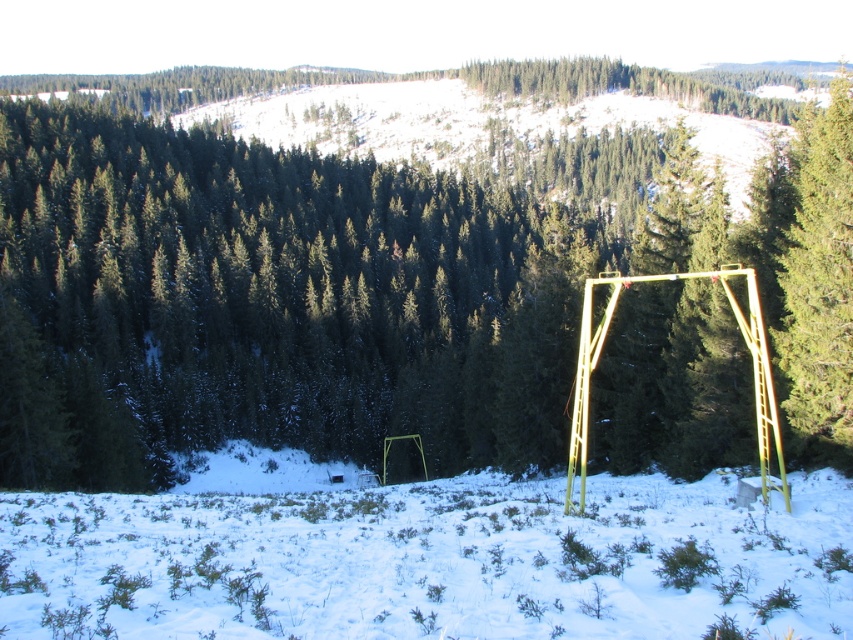
Question: From the image, what is the correct spatial relationship of green matte swing at center in relation to green matte tree at center-right?

Choices:
 (A) below
 (B) above

Answer: (B)

Question: Among these objects, which one is nearest to the camera?

Choices:
 (A) green matte swing at center
 (B) green matte tree at center-right
 (C) white powdery snow at lower center

Answer: (C)

Question: Considering the relative positions of green matte swing at center and white powdery snow at lower center in the image provided, where is green matte swing at center located with respect to white powdery snow at lower center?

Choices:
 (A) right
 (B) left

Answer: (A)

Question: Where is green matte swing at center located in relation to green matte tree at center-right in the image?

Choices:
 (A) left
 (B) right

Answer: (A)

Question: Which point appears closest to the camera in this image?

Choices:
 (A) (849, 150)
 (B) (805, 172)

Answer: (A)

Question: Which of these objects is positioned farthest from the green matte tree at center-right?

Choices:
 (A) green matte swing at center
 (B) white powdery snow at lower center

Answer: (A)